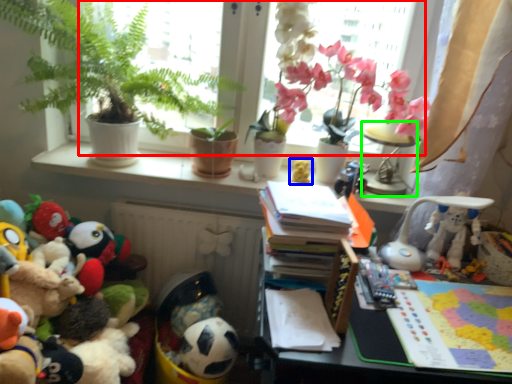
Question: Estimate the real-world distances between objects in this image. Which object is closer to window screen (highlighted by a red box), toy (highlighted by a blue box) or lamp (highlighted by a green box)?

Choices:
 (A) toy
 (B) lamp

Answer: (A)